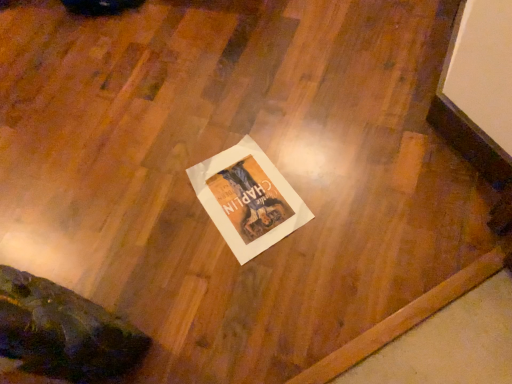
At what (x,y) coordinates should I click in order to perform the action: click on blank area beneath white paper poster at center (from a real-world perspective). Please return your answer as a coordinate pair (x, y). The image size is (512, 384). Looking at the image, I should click on (257, 207).